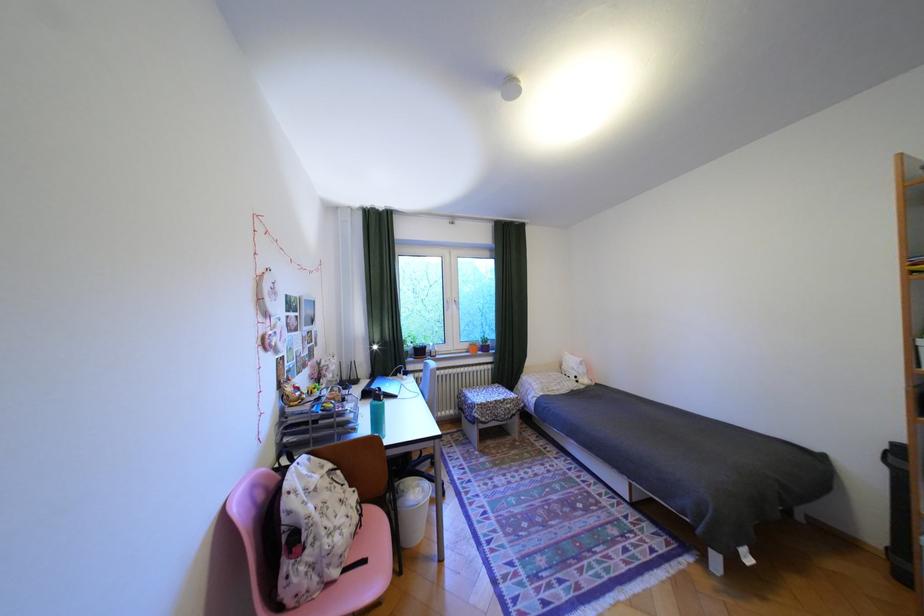
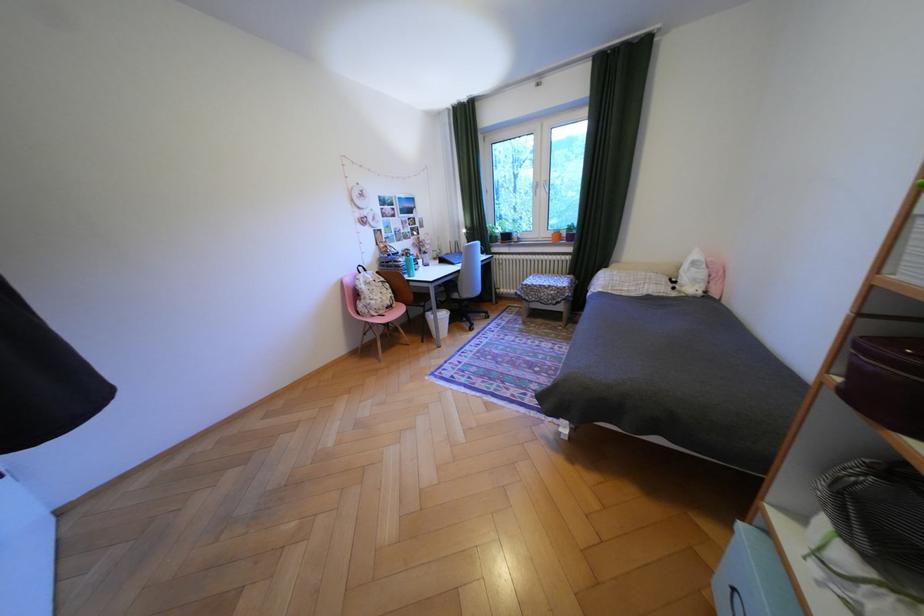
Where in the second image is the point corresponding to pixel 516 400 from the first image?

(562, 286)